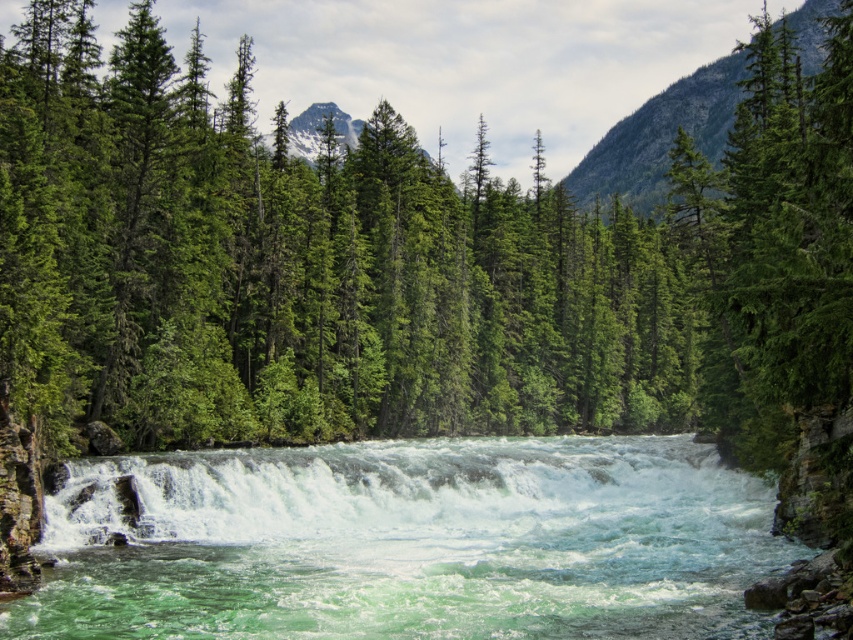
You are navigating a small drone over the forest scene. The drone must avoid obstacles and reach a specific coordinate. Given the green matte tree at center is at point 0.402, 0.485, can you confirm if this tree is positioned at the exact center of the image?

The green matte tree at center is located at point (x=413, y=257), which is not the exact center of the image. The exact center would be at coordinates (x=426, y=320). Since 0.402 and 0.485 are both less than 0.5, the tree is slightly to the left and above the true center.

You are standing at the point marked as point (x=413, y=257) in the image. What is the nearest object to you in the scene?

The nearest object to you is the green matte tree at center, as the point (x=413, y=257) is located on it.

You are a hiker standing at the edge of the forest near the river. You see the green matte tree at center and the translucent white water at center. Which object is positioned to the right of the other?

The green matte tree at center is to the right of the translucent white water at center.